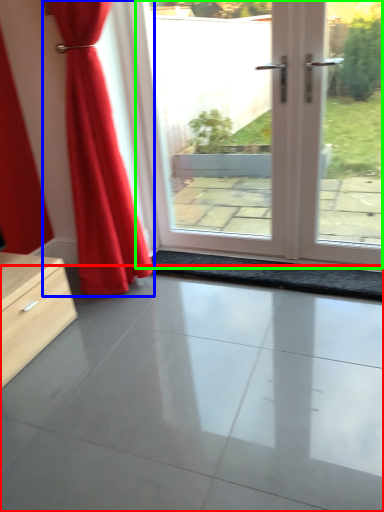
Question: Which object is the closest to the concrete (highlighted by a red box)? Choose among these: curtain (highlighted by a blue box) or door (highlighted by a green box).

Choices:
 (A) curtain
 (B) door

Answer: (A)